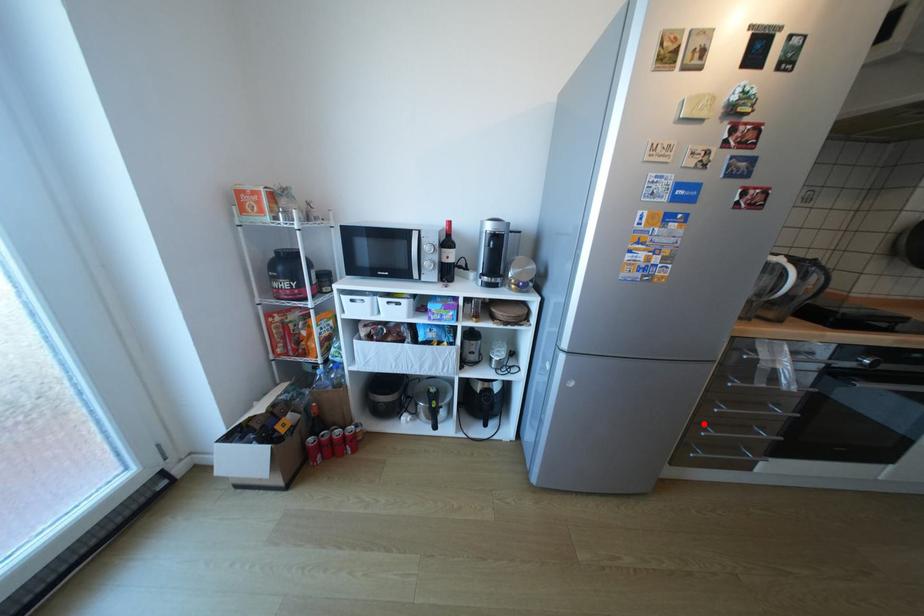
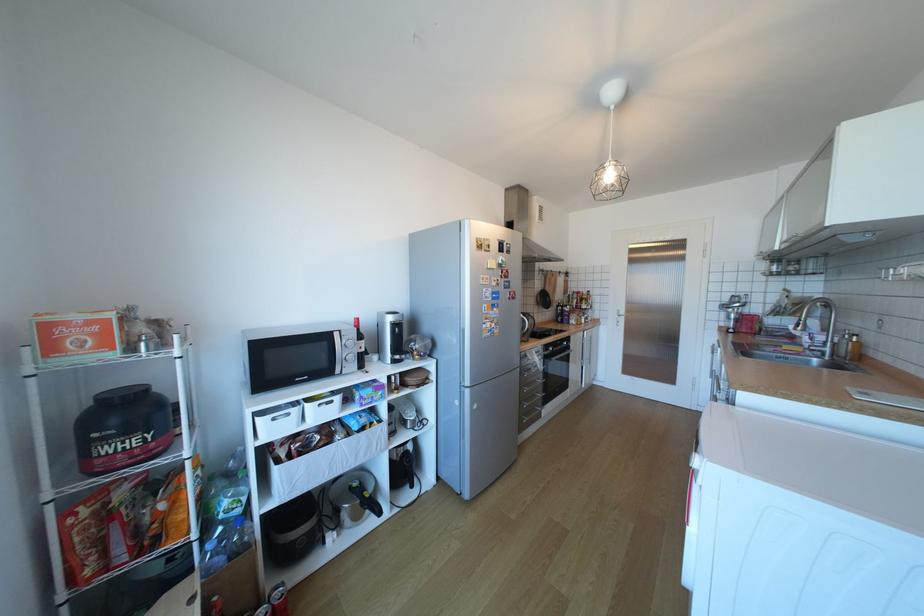
Question: I am providing you with two images of the same scene from different viewpoints. A red point is shown in image1. For the corresponding object point in image2, is it positioned nearer or farther from the camera?

Choices:
 (A) Nearer
 (B) Farther

Answer: (B)